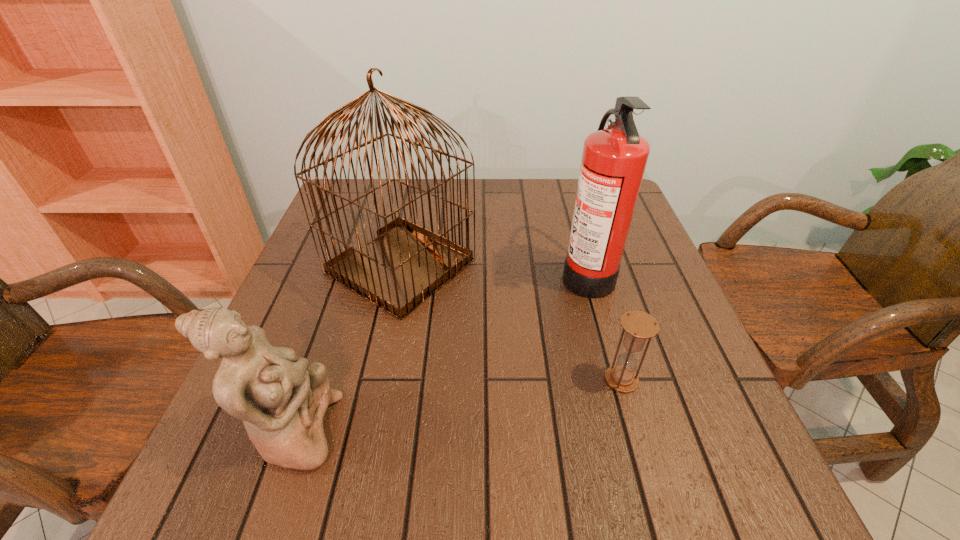
Identify the location of vacant region between the shortest object and the fire extinguisher. The image size is (960, 540). (604, 327).

Where is `empty space that is in between the birdcage and the second shortest object`? This screenshot has width=960, height=540. empty space that is in between the birdcage and the second shortest object is located at coordinates (347, 349).

The width and height of the screenshot is (960, 540). What are the coordinates of `object that stands as the closest to the birdcage` in the screenshot? It's located at (282, 400).

Identify which object is the third nearest to the birdcage. Please provide its 2D coordinates. Your answer should be formatted as a tuple, i.e. [(x, y)], where the tuple contains the x and y coordinates of a point satisfying the conditions above.

[(638, 325)]

Find the location of a particular element. vacant area in the image that satisfies the following two spatial constraints: 1. on the front-facing side of the hourglass; 2. on the left side of the fire extinguisher is located at coordinates tap(616, 380).

Identify the location of free space in the image that satisfies the following two spatial constraints: 1. on the front side of the birdcage; 2. on the left side of the shortest object. (376, 380).